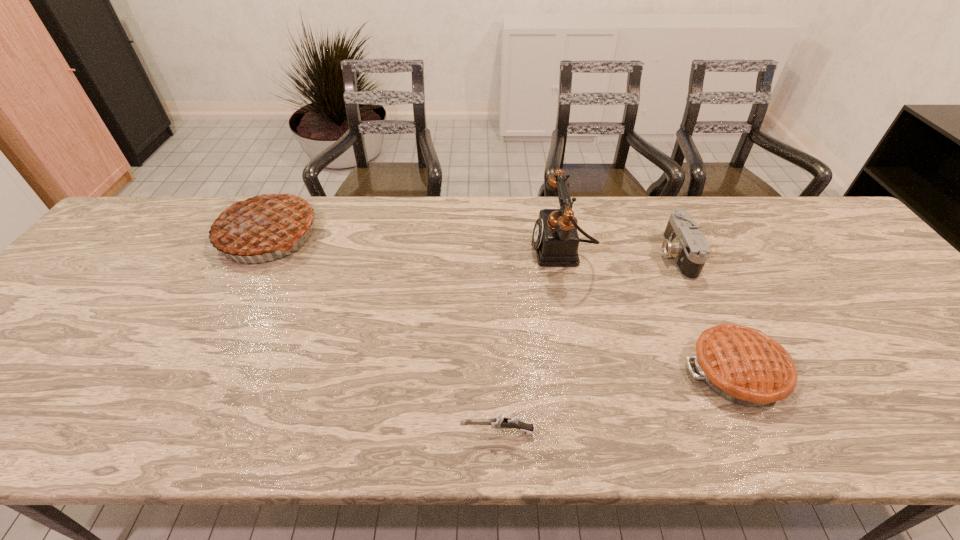
I want to click on free space located 0.070m on the front of the third object from right to left at the rotary dial, so [x=507, y=249].

This screenshot has height=540, width=960. In order to click on vacant space located 0.150m on the front of the third object from right to left at the rotary dial in this screenshot , I will do `click(479, 249)`.

Find the location of a particular element. The width and height of the screenshot is (960, 540). free spot located 0.150m on the lens of the camera is located at coordinates (607, 254).

The width and height of the screenshot is (960, 540). I want to click on vacant space situated 0.080m on the lens of the camera, so click(632, 254).

You are a GUI agent. You are given a task and a screenshot of the screen. Output one action in this format:
    pyautogui.click(x=<x>, y=<y>)
    Task: Click on the vacant point located on the lens of the camera
    This screenshot has height=540, width=960.
    Given the screenshot: What is the action you would take?
    pyautogui.click(x=517, y=254)

In order to click on vacant space located 0.130m on the right of the shorter pie in this screenshot , I will do `click(849, 372)`.

Identify the location of vacant space situated 0.330m aimed along the barrel of the gun. The width and height of the screenshot is (960, 540). (293, 432).

Identify the location of free space located 0.050m aimed along the barrel of the gun. (435, 432).

The width and height of the screenshot is (960, 540). I want to click on free space located 0.150m aimed along the barrel of the gun, so click(x=384, y=432).

At what (x,y) coordinates should I click in order to perform the action: click on pie that is at the far edge. Please return your answer as a coordinate pair (x, y). This screenshot has height=540, width=960. Looking at the image, I should click on point(261,223).